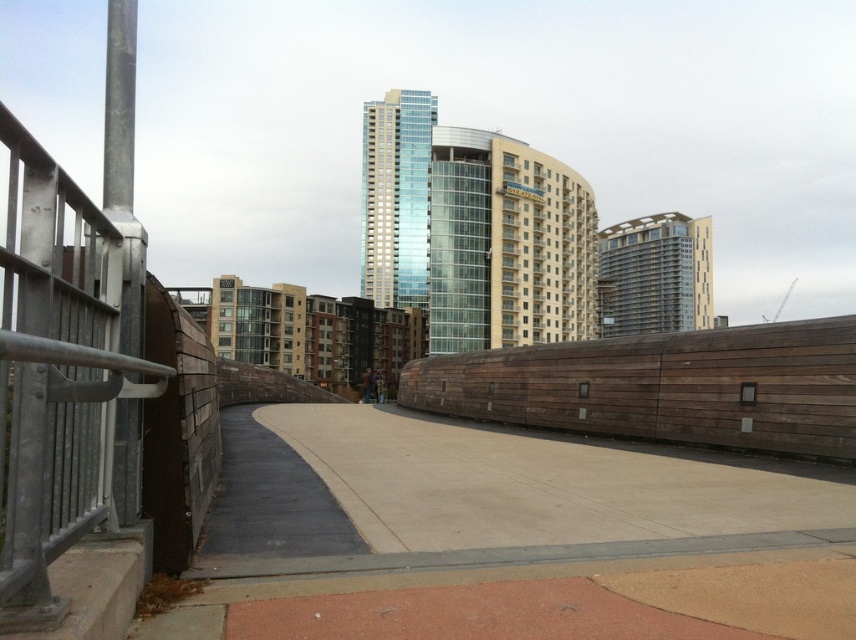
You are a delivery drone flying over the city and need to land on a flat surface near the silver metallic railing at left and the brown wooden fence at center. Which object is closer to your current position if you are directly above the pathway?

The silver metallic railing at left is closer because it is in front of the brown wooden fence at center, meaning it is nearer to your current position above the pathway.

You are a delivery drone flying above the city and need to navigate between the silver metallic railing at left and the brown wooden fence at center. Which object is higher from the ground?

The silver metallic railing at left is higher from the ground than the brown wooden fence at center.

You are a city planner designing a new walkway. You have two materials available for a railing system. The silver metallic railing at left and the brown wooden fence at center. If you want to choose the narrower material for a tight space, which one should you select?

The silver metallic railing at left is narrower than the brown wooden fence at center, so you should select the silver metallic railing at left for the tight space.